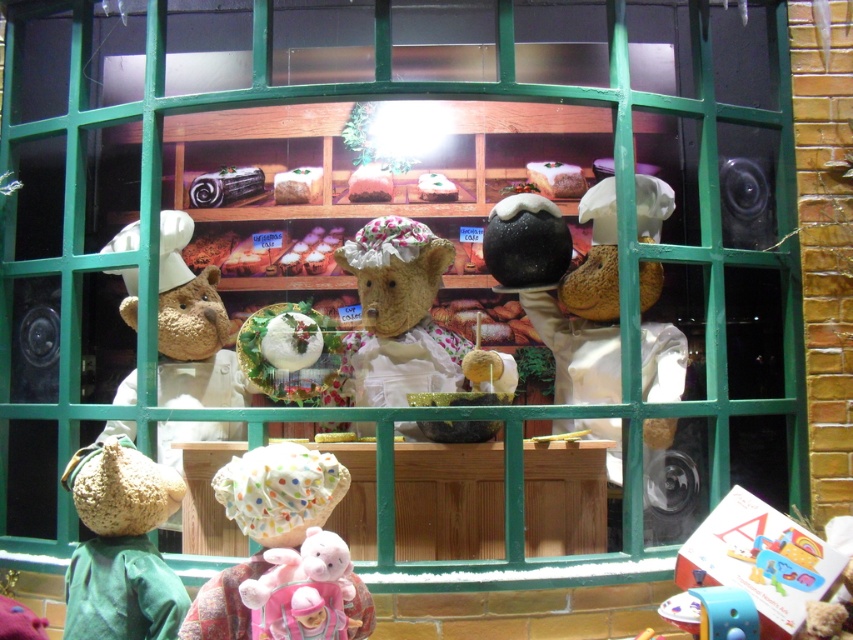
Question: Which point is farther to the camera?

Choices:
 (A) cardboard box at lower right
 (B) fluffy white teddy bear at center
 (C) knitted green hat at lower left

Answer: (B)

Question: Is knitted green hat at lower left to the left of polka dot fabric hat at lower center from the viewer's perspective?

Choices:
 (A) yes
 (B) no

Answer: (A)

Question: Among these objects, which one is nearest to the camera?

Choices:
 (A) cardboard box at lower right
 (B) polka dot fabric hat at lower center

Answer: (B)

Question: Can you confirm if polka dot fabric hat at lower center is positioned to the left of cardboard box at lower right?

Choices:
 (A) yes
 (B) no

Answer: (A)

Question: Is the position of fluffy white teddy bear at center less distant than that of cardboard box at lower right?

Choices:
 (A) no
 (B) yes

Answer: (A)

Question: Among these objects, which one is nearest to the camera?

Choices:
 (A) cardboard box at lower right
 (B) fluffy white teddy bear at center

Answer: (A)